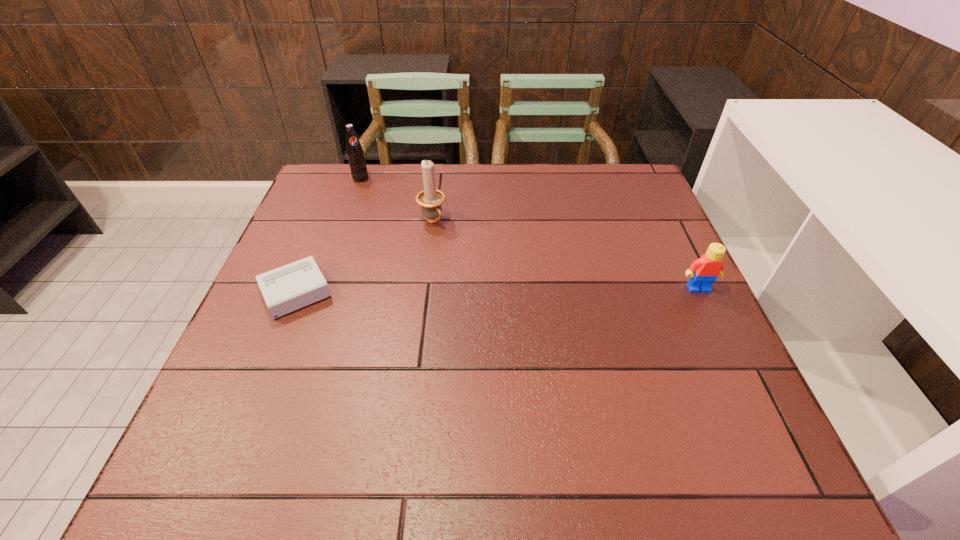
The width and height of the screenshot is (960, 540). Find the location of `free region at the near edge of the desktop`. free region at the near edge of the desktop is located at coordinates (554, 403).

In the image, there is a desktop. Find the location of `vacant space at the left edge`. vacant space at the left edge is located at coordinates (319, 213).

I want to click on vacant space at the right edge of the desktop, so click(675, 276).

In the image, there is a desktop. What are the coordinates of `vacant space at the far left corner` in the screenshot? It's located at coord(349,172).

Identify the location of free space at the near left corner of the desktop. This screenshot has width=960, height=540. (243, 410).

Where is `vacant region at the far right corner`? This screenshot has height=540, width=960. vacant region at the far right corner is located at coordinates (630, 209).

Locate an element on the screen. free spot between the candle_holder and the alarm clock is located at coordinates (364, 256).

Identify the location of vacant space that's between the farthest object and the third tallest object. (529, 233).

Where is `free space between the alarm clock and the rightmost object`? This screenshot has width=960, height=540. free space between the alarm clock and the rightmost object is located at coordinates (496, 289).

Where is `unoccupied position between the pop and the rightmost object`? unoccupied position between the pop and the rightmost object is located at coordinates (529, 233).